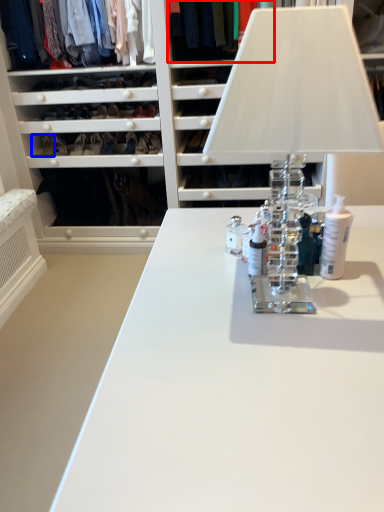
Question: Which object is further to the camera taking this photo, clothing (highlighted by a red box) or shoe (highlighted by a blue box)?

Choices:
 (A) clothing
 (B) shoe

Answer: (B)